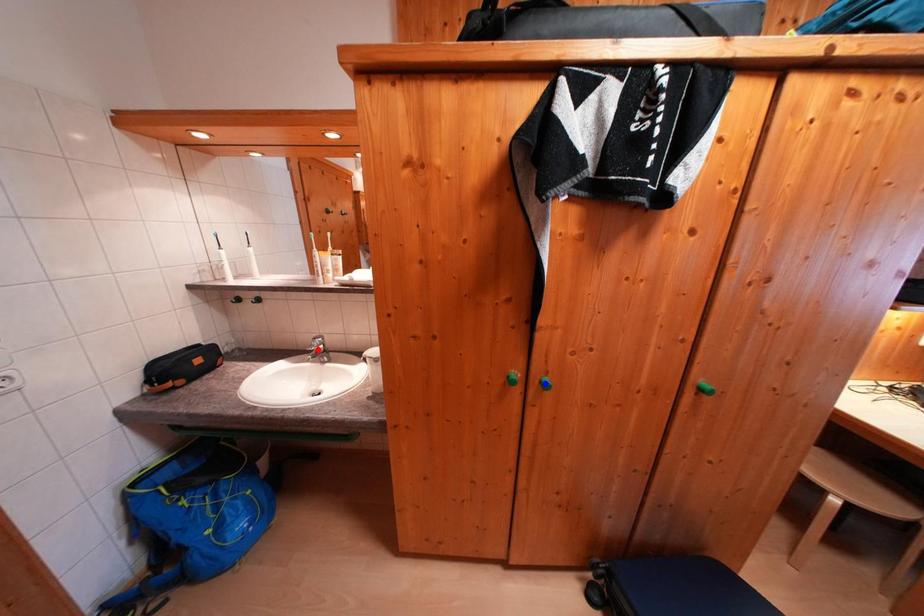
Question: Which of the two points in the image is closer to the camera?

Choices:
 (A) Blue point is closer.
 (B) Red point is closer.

Answer: (A)